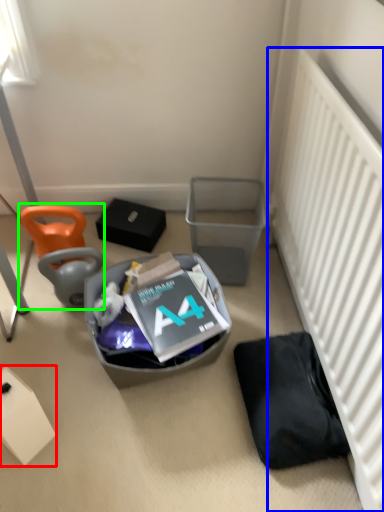
Question: Which object is positioned closest to box (highlighted by a red box)? Select from radiator (highlighted by a blue box) and bean bag chair (highlighted by a green box).

Choices:
 (A) radiator
 (B) bean bag chair

Answer: (B)